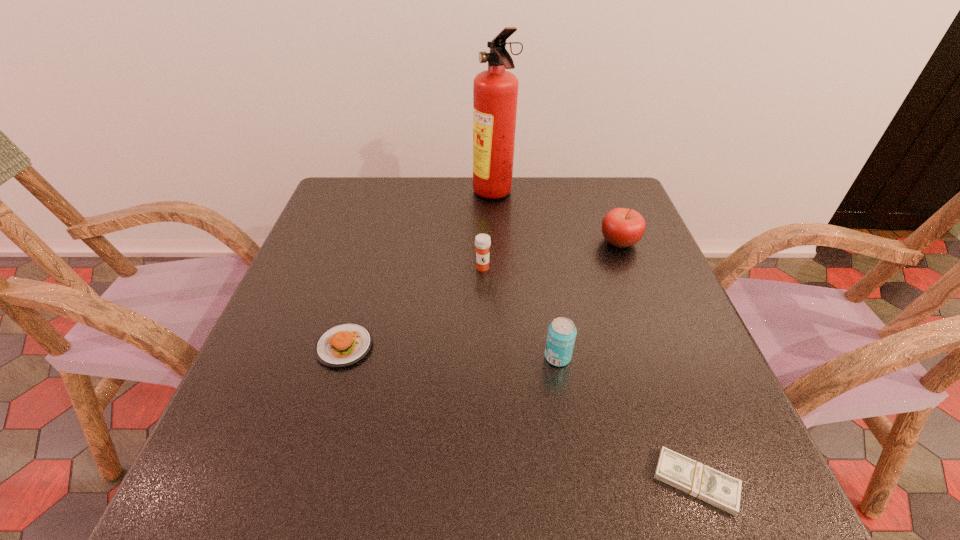
The height and width of the screenshot is (540, 960). I want to click on the tallest object, so click(495, 91).

You are a GUI agent. You are given a task and a screenshot of the screen. Output one action in this format:
    pyautogui.click(x=<x>, y=<y>)
    Task: Click on the fire extinguisher
    The height and width of the screenshot is (540, 960).
    Given the screenshot: What is the action you would take?
    point(495,91)

Where is `the fifth nearest object`? The width and height of the screenshot is (960, 540). the fifth nearest object is located at coordinates (621, 227).

Locate an element on the screen. This screenshot has width=960, height=540. beer can is located at coordinates (562, 332).

Find the location of a particular element. medicine is located at coordinates (482, 241).

The height and width of the screenshot is (540, 960). In order to click on the fifth tallest object in this screenshot , I will do `click(342, 345)`.

You are a GUI agent. You are given a task and a screenshot of the screen. Output one action in this format:
    pyautogui.click(x=<x>, y=<y>)
    Task: Click on the leftmost object
    
    Given the screenshot: What is the action you would take?
    pyautogui.click(x=342, y=345)

You are a GUI agent. You are given a task and a screenshot of the screen. Output one action in this format:
    pyautogui.click(x=<x>, y=<y>)
    Task: Click on the nearest object
    This screenshot has height=540, width=960.
    Given the screenshot: What is the action you would take?
    pyautogui.click(x=705, y=483)

Where is `the shortest object`? the shortest object is located at coordinates (705, 483).

Image resolution: width=960 pixels, height=540 pixels. I want to click on vacant area situated 0.200m on the front-facing side of the fire extinguisher, so click(x=405, y=194).